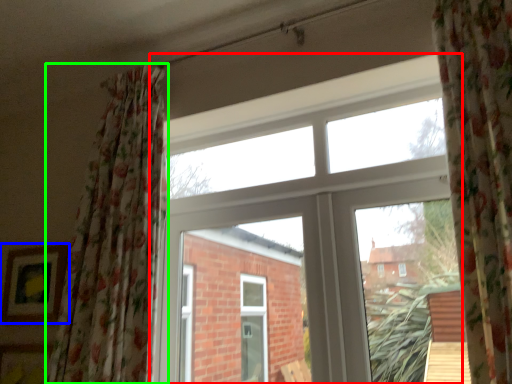
Question: Considering the real-world distances, which object is farthest from window (highlighted by a red box)? picture frame (highlighted by a blue box) or curtain (highlighted by a green box)?

Choices:
 (A) picture frame
 (B) curtain

Answer: (A)